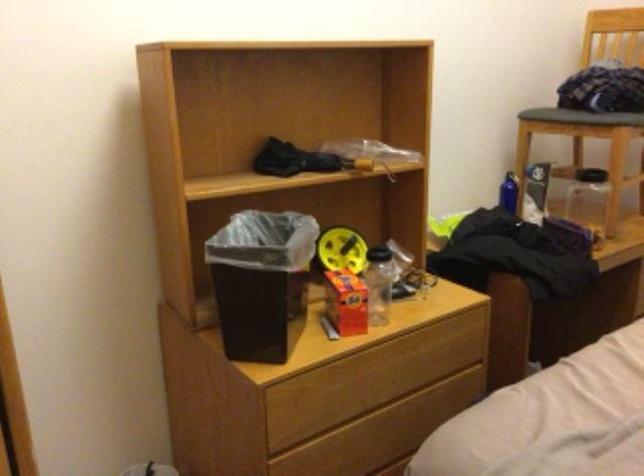
The image size is (644, 476). Identify the location of clear plastic bottle. (380, 283).